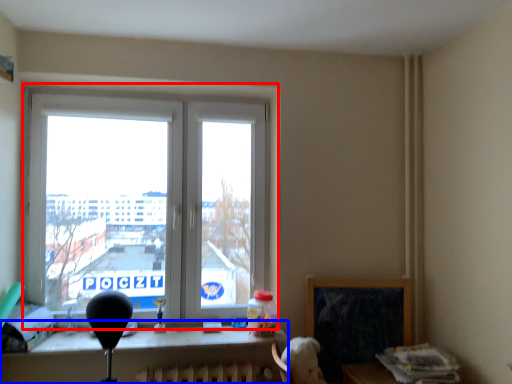
Question: Which object is further to the camera taking this photo, window (highlighted by a red box) or table (highlighted by a blue box)?

Choices:
 (A) window
 (B) table

Answer: (A)